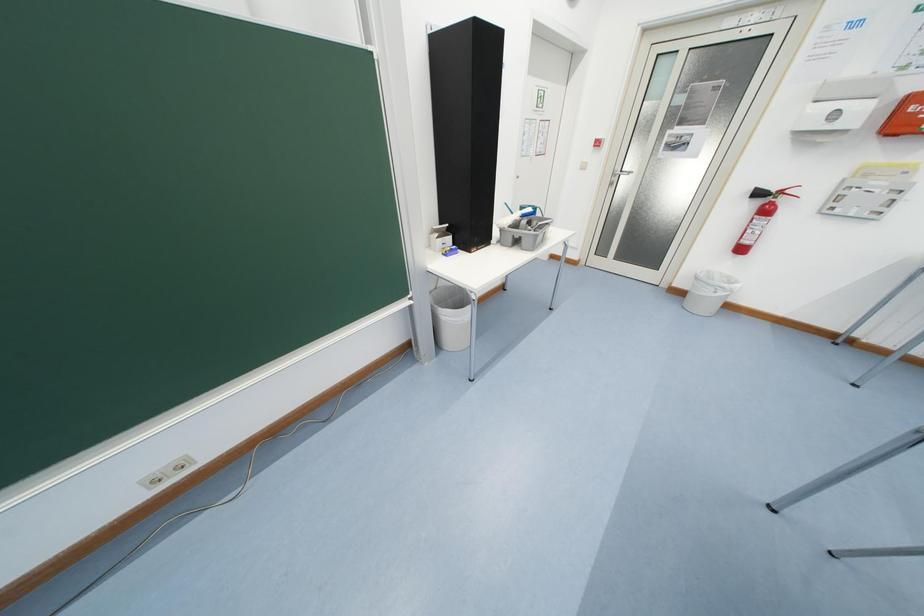
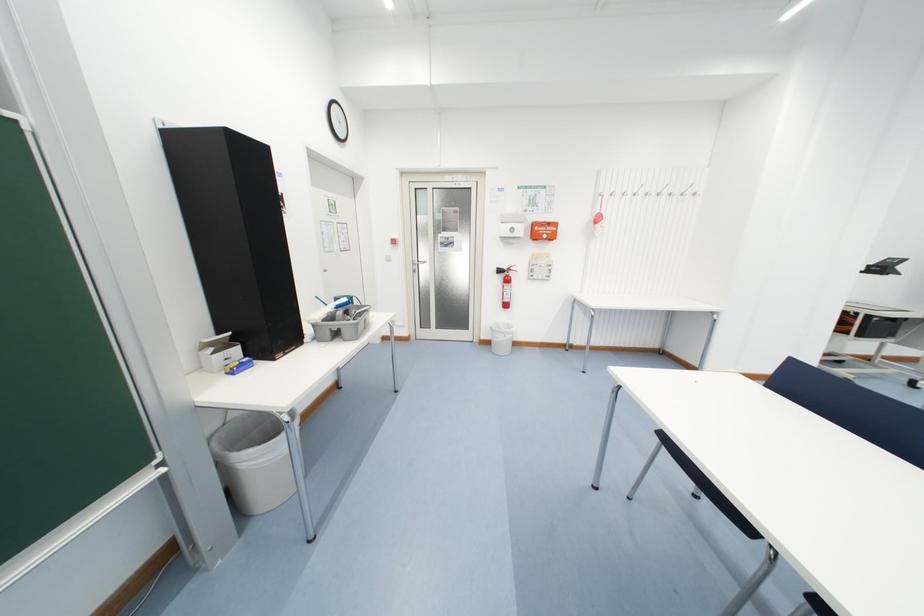
Question: How did the camera likely rotate?

Choices:
 (A) Left
 (B) Right
 (C) Up
 (D) Down

Answer: (B)